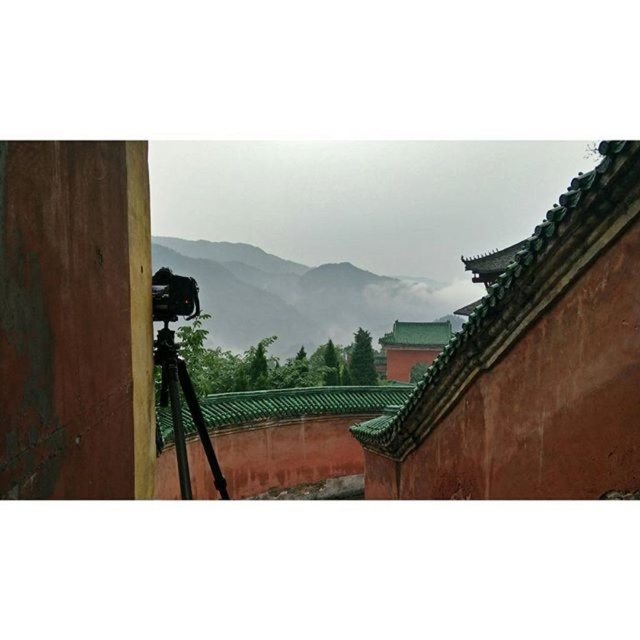
Can you confirm if green metallic tripod at center is taller than black plastic camera at lower left?

In fact, green metallic tripod at center may be shorter than black plastic camera at lower left.

Can you confirm if green metallic tripod at center is bigger than black plastic camera at lower left?

Actually, green metallic tripod at center might be smaller than black plastic camera at lower left.

The image size is (640, 640). What do you see at coordinates (180, 408) in the screenshot? I see `green metallic tripod at center` at bounding box center [180, 408].

At what (x,y) coordinates should I click in order to perform the action: click on green metallic tripod at center. Please return your answer as a coordinate pair (x, y). Looking at the image, I should click on (180, 408).

Between green matte mountain at center and black plastic camera at lower left, which one has more height?

green matte mountain at center

Can you confirm if green matte mountain at center is bigger than black plastic camera at lower left?

Indeed, green matte mountain at center has a larger size compared to black plastic camera at lower left.

Is point (237, 244) positioned in front of point (182, 300)?

No, it is behind (182, 300).

Locate an element on the screen. The height and width of the screenshot is (640, 640). green matte mountain at center is located at coordinates (291, 294).

Can you confirm if green matte mountain at center is positioned below green metallic tripod at center?

Correct, green matte mountain at center is located below green metallic tripod at center.

Which of these two, green matte mountain at center or green metallic tripod at center, stands taller?

Standing taller between the two is green matte mountain at center.

Which is in front, point (388, 323) or point (173, 376)?

Positioned in front is point (173, 376).

This screenshot has width=640, height=640. Find the location of `green matte mountain at center`. green matte mountain at center is located at coordinates (291, 294).